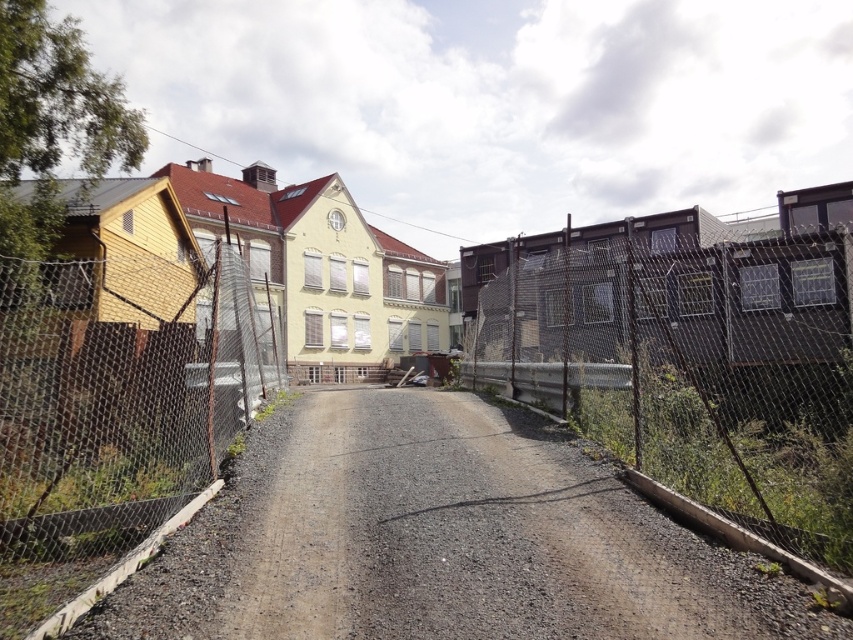
How much distance is there between gray gravel road at center and rusty chain-link fence at right?

gray gravel road at center and rusty chain-link fence at right are 15.66 meters apart.

Image resolution: width=853 pixels, height=640 pixels. Describe the element at coordinates (439, 540) in the screenshot. I see `gray gravel road at center` at that location.

Does point (734, 596) lie in front of point (664, 449)?

Yes, point (734, 596) is in front of point (664, 449).

Identify the location of gray gravel road at center. click(439, 540).

Who is positioned more to the left, rusty chain-link fence at right or wire mesh fence at left?

wire mesh fence at left is more to the left.

Locate an element on the screen. Image resolution: width=853 pixels, height=640 pixels. rusty chain-link fence at right is located at coordinates (692, 365).

At what (x,y) coordinates should I click in order to perform the action: click on rusty chain-link fence at right. Please return your answer as a coordinate pair (x, y). The width and height of the screenshot is (853, 640). Looking at the image, I should click on (692, 365).

Does gray gravel road at center have a greater width compared to wire mesh fence at left?

Incorrect, gray gravel road at center's width does not surpass wire mesh fence at left's.

Based on the photo, does gray gravel road at center appear on the left side of wire mesh fence at left?

In fact, gray gravel road at center is to the right of wire mesh fence at left.

Is point (408, 630) farther from viewer compared to point (241, 380)?

No.

Image resolution: width=853 pixels, height=640 pixels. Identify the location of gray gravel road at center. (439, 540).